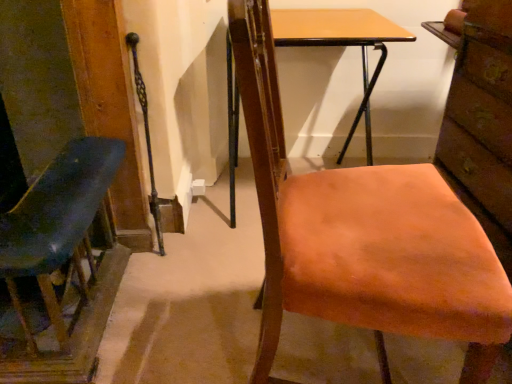
Question: Is brick textured drawer at right surrounded by matte blue chair at left, the second chair when ordered from right to left?

Choices:
 (A) yes
 (B) no

Answer: (B)

Question: Is matte blue chair at left, the second chair when ordered from right to left, to the left of brick textured drawer at right from the viewer's perspective?

Choices:
 (A) no
 (B) yes

Answer: (B)

Question: Considering the relative sizes of matte blue chair at left, arranged as the first chair when viewed from the left, and brick textured drawer at right in the image provided, is matte blue chair at left, arranged as the first chair when viewed from the left, smaller than brick textured drawer at right?

Choices:
 (A) yes
 (B) no

Answer: (B)

Question: Is brick textured drawer at right at the back of matte blue chair at left, the second chair when ordered from right to left?

Choices:
 (A) yes
 (B) no

Answer: (B)

Question: Considering the relative sizes of matte blue chair at left, the second chair when ordered from right to left, and brick textured drawer at right in the image provided, is matte blue chair at left, the second chair when ordered from right to left, taller than brick textured drawer at right?

Choices:
 (A) no
 (B) yes

Answer: (A)

Question: In the image, is matte blue chair at left, arranged as the first chair when viewed from the left, positioned in front of or behind brick textured drawer at right?

Choices:
 (A) front
 (B) behind

Answer: (A)

Question: From their relative heights in the image, would you say matte blue chair at left, the second chair when ordered from right to left, is taller or shorter than brick textured drawer at right?

Choices:
 (A) tall
 (B) short

Answer: (B)

Question: Is matte blue chair at left, the second chair when ordered from right to left, inside the boundaries of brick textured drawer at right, or outside?

Choices:
 (A) inside
 (B) outside

Answer: (B)

Question: From the image's perspective, relative to brick textured drawer at right, is matte blue chair at left, arranged as the first chair when viewed from the left, above or below?

Choices:
 (A) above
 (B) below

Answer: (B)

Question: From the image's perspective, is light brown wood desk at center positioned above or below orange fabric chair at center, which is the first chair from right to left?

Choices:
 (A) above
 (B) below

Answer: (A)

Question: Considering their positions, is light brown wood desk at center located in front of or behind orange fabric chair at center, which is the first chair from right to left?

Choices:
 (A) behind
 (B) front

Answer: (A)

Question: In terms of height, does light brown wood desk at center look taller or shorter compared to orange fabric chair at center, which is the first chair from right to left?

Choices:
 (A) short
 (B) tall

Answer: (A)

Question: Considering the positions of point (303, 31) and point (342, 220), is point (303, 31) closer or farther from the camera than point (342, 220)?

Choices:
 (A) farther
 (B) closer

Answer: (A)

Question: From a real-world perspective, is orange fabric chair at center, which is the first chair from right to left, physically located above or below matte blue chair at left, the second chair when ordered from right to left?

Choices:
 (A) above
 (B) below

Answer: (A)

Question: Is orange fabric chair at center, which is the first chair from right to left, wider or thinner than matte blue chair at left, the second chair when ordered from right to left?

Choices:
 (A) wide
 (B) thin

Answer: (B)